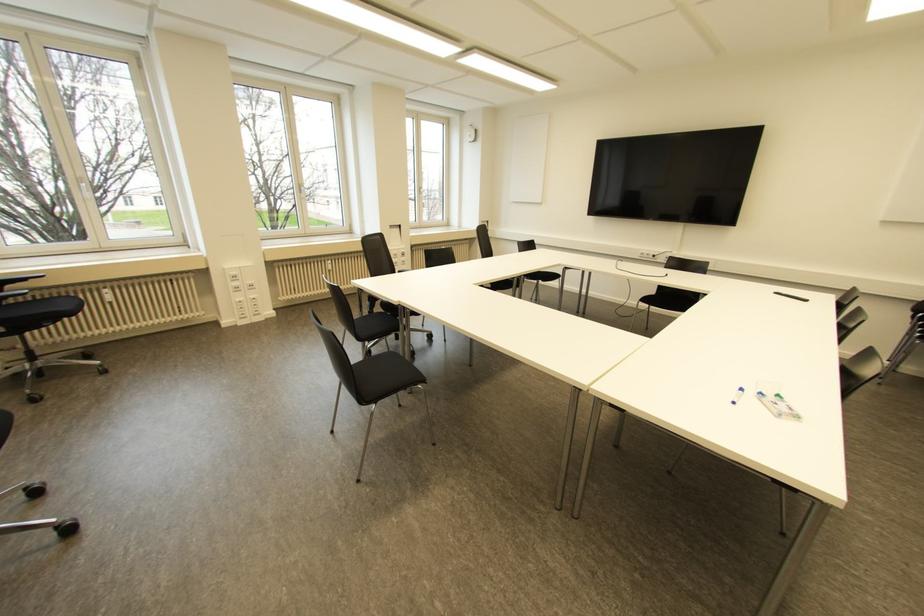
This screenshot has width=924, height=616. What do you see at coordinates (326, 265) in the screenshot?
I see `a white radiator dial` at bounding box center [326, 265].